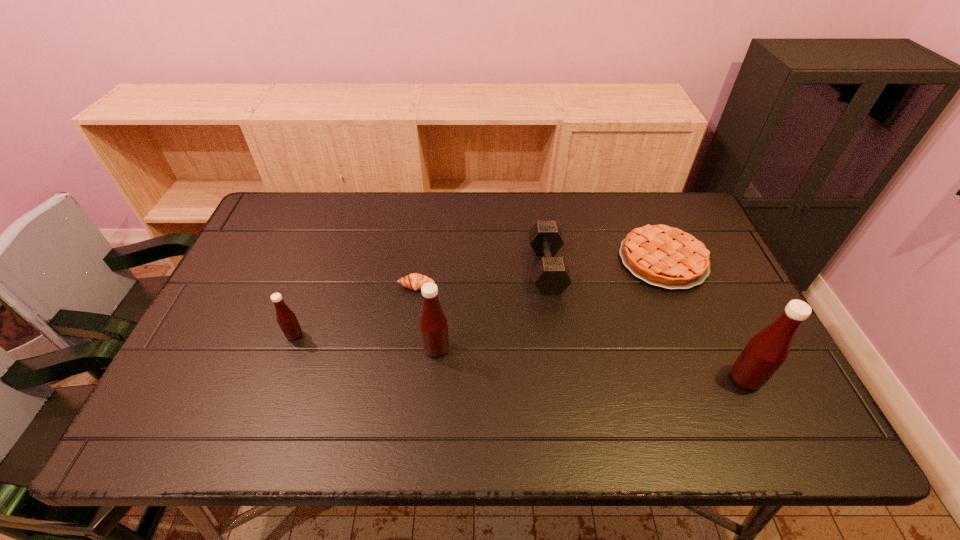
Locate an element on the screen. The width and height of the screenshot is (960, 540). vacant space situated 0.340m on the right of the leftmost object is located at coordinates (437, 335).

Where is `free region located on the right of the second Tabasco sauce from right to left`? This screenshot has width=960, height=540. free region located on the right of the second Tabasco sauce from right to left is located at coordinates (575, 349).

Where is `free space located on the back of the rightmost Tabasco sauce`? Image resolution: width=960 pixels, height=540 pixels. free space located on the back of the rightmost Tabasco sauce is located at coordinates (702, 288).

At what (x,y) coordinates should I click in order to perform the action: click on vacant space located on the front of the fifth tallest object. Please return your answer as a coordinate pair (x, y). Looking at the image, I should click on (712, 377).

Locate an element on the screen. free space located 0.270m on the back of the third object from right to left is located at coordinates (536, 193).

At what (x,y) coordinates should I click in order to perform the action: click on vacant space situated 0.080m on the front-facing side of the shortest object. Please return your answer as a coordinate pair (x, y). This screenshot has height=540, width=960. Looking at the image, I should click on (413, 315).

You are a GUI agent. You are given a task and a screenshot of the screen. Output one action in this format:
    pyautogui.click(x=<x>, y=<y>)
    Task: Click on the object that is at the far edge
    
    Given the screenshot: What is the action you would take?
    pyautogui.click(x=663, y=256)

Image resolution: width=960 pixels, height=540 pixels. Identify the location of object situated at the near edge. (766, 351).

This screenshot has width=960, height=540. I want to click on Tabasco sauce at the right edge, so click(766, 351).

Find the location of a particular element. The height and width of the screenshot is (540, 960). pie present at the right edge is located at coordinates (663, 256).